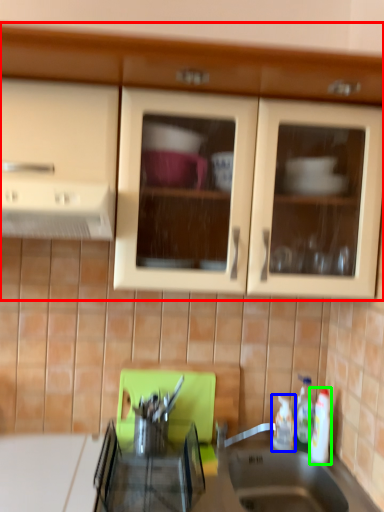
Question: Which is farther away from cabinetry (highlighted by a red box)? bottle (highlighted by a blue box) or bottle (highlighted by a green box)?

Choices:
 (A) bottle
 (B) bottle

Answer: (A)